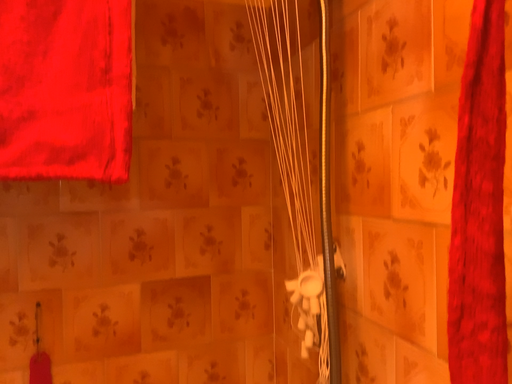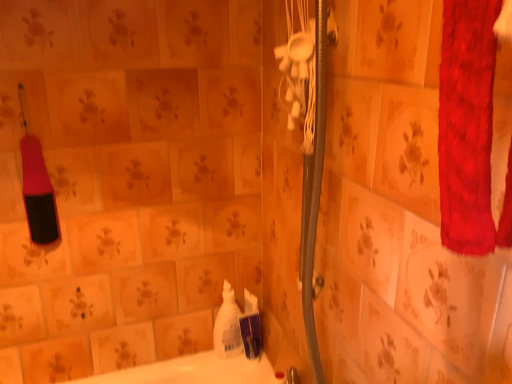
Question: How did the camera likely rotate when shooting the video?

Choices:
 (A) rotated upward
 (B) rotated downward

Answer: (B)